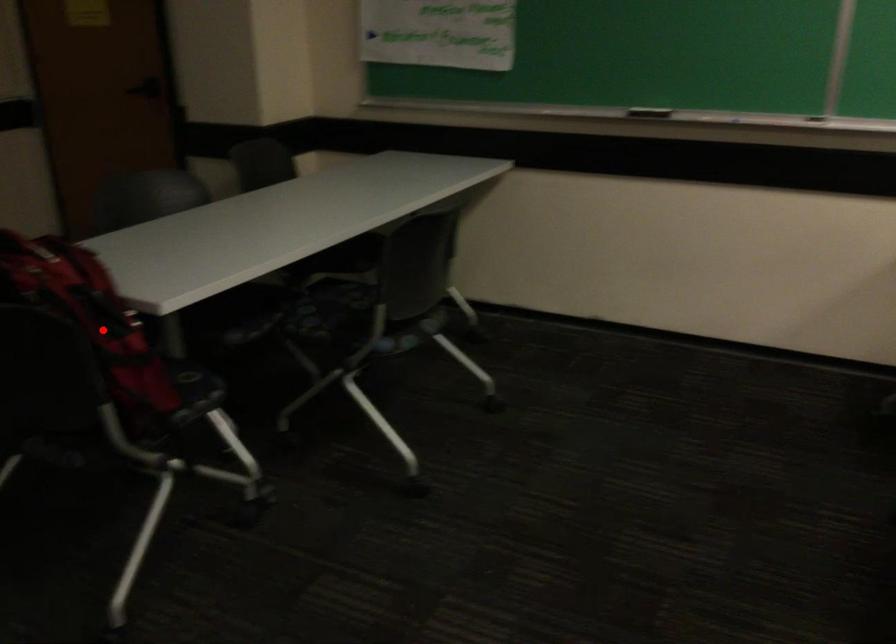
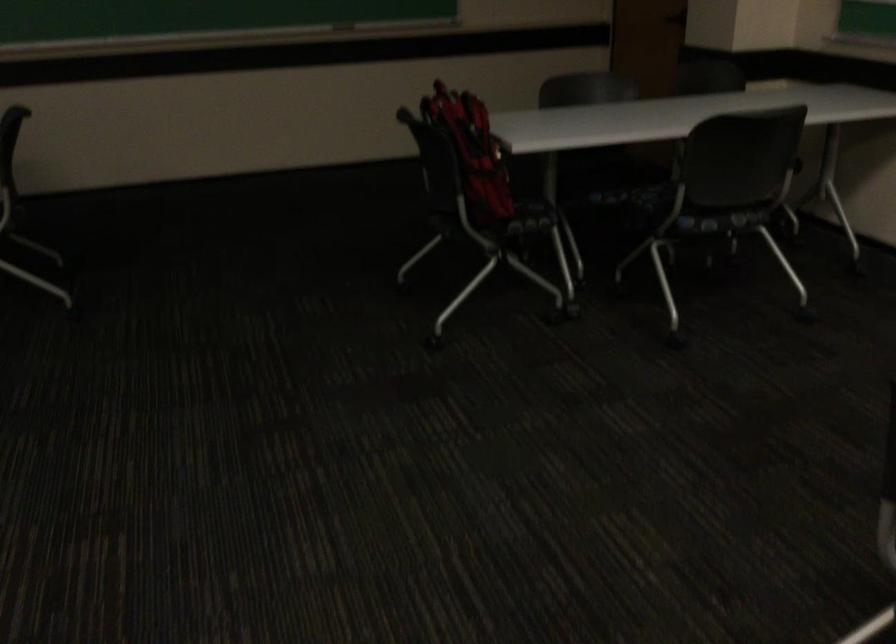
Where in the second image is the point corresponding to the highlighted location from the first image?

(471, 152)